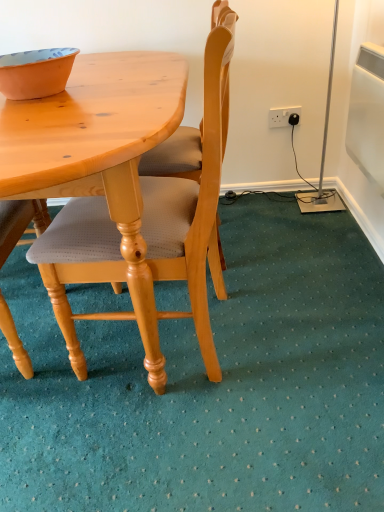
What do you see at coordinates (284, 116) in the screenshot?
I see `white plastic power outlet at upper right` at bounding box center [284, 116].

Locate an element on the screen. This screenshot has width=384, height=512. light wood/light brown chair at center is located at coordinates (192, 192).

Where is `bowl above the white plastic power outlet at upper right (from a real-world perspective)`? bowl above the white plastic power outlet at upper right (from a real-world perspective) is located at coordinates (35, 72).

Considering the points (284, 123) and (0, 62), which point is in front, point (284, 123) or point (0, 62)?

The point (0, 62) is closer to the camera.

Is white plastic power outlet at upper right wider than orange matte bowl at upper left?

In fact, white plastic power outlet at upper right might be narrower than orange matte bowl at upper left.

Is white plastic power outlet at upper right oriented towards orange matte bowl at upper left?

No, white plastic power outlet at upper right is not turned towards orange matte bowl at upper left.

From the image's perspective, would you say orange matte bowl at upper left is positioned over light wood/light brown chair at center?

Yes, from the image's perspective, orange matte bowl at upper left is above light wood/light brown chair at center.

Which is in front, point (76, 52) or point (109, 248)?

The point (109, 248) is closer.

Which object is positioned more to the right, orange matte bowl at upper left or light wood/light brown chair at center?

Positioned to the right is light wood/light brown chair at center.

You are a GUI agent. You are given a task and a screenshot of the screen. Output one action in this format:
    pyautogui.click(x=<x>, y=<y>)
    Task: Click on the power outlet behind the light wood/light brown chair at center
    
    Given the screenshot: What is the action you would take?
    coord(284,116)

Is light wood/light brown chair at center closer to the viewer compared to white plastic power outlet at upper right?

Yes, light wood/light brown chair at center is closer to the camera.

Is light wood/light brown chair at center facing away from white plastic power outlet at upper right?

light wood/light brown chair at center is not turned away from white plastic power outlet at upper right.

From the picture: Is there a large distance between light wood/light brown chair at center and white plastic power outlet at upper right?

Yes.

Is white plastic power outlet at upper right positioned in front of light wood/light brown chair at center?

No, it is not.

Is white plastic power outlet at upper right beside light wood/light brown chair at center?

There is a gap between white plastic power outlet at upper right and light wood/light brown chair at center.

From a real-world perspective, does white plastic power outlet at upper right stand above light wood/light brown chair at center?

No, from a real-world perspective, white plastic power outlet at upper right is not over light wood/light brown chair at center

Considering the relative positions of white plastic power outlet at upper right and light wood/light brown chair at center in the image provided, is white plastic power outlet at upper right to the right of light wood/light brown chair at center from the viewer's perspective?

Correct, you'll find white plastic power outlet at upper right to the right of light wood/light brown chair at center.

Which object is positioned more to the left, orange matte bowl at upper left or white plastic power outlet at upper right?

From the viewer's perspective, orange matte bowl at upper left appears more on the left side.

From the image's perspective, would you say orange matte bowl at upper left is shown under white plastic power outlet at upper right?

Yes, from the image's perspective, orange matte bowl at upper left is beneath white plastic power outlet at upper right.

Is orange matte bowl at upper left not close to white plastic power outlet at upper right?

Absolutely, orange matte bowl at upper left is distant from white plastic power outlet at upper right.

The image size is (384, 512). Identify the location of bowl that appears on the left of white plastic power outlet at upper right. (35, 72).

Is point (209, 263) positioned in front of point (25, 65)?

No.

Is light wood/light brown chair at center surrounding orange matte bowl at upper left?

Definitely not — orange matte bowl at upper left is not inside light wood/light brown chair at center.

Which object is more forward, light wood/light brown chair at center or orange matte bowl at upper left?

light wood/light brown chair at center is in front.

Which object is thinner, light wood/light brown chair at center or orange matte bowl at upper left?

orange matte bowl at upper left.

This screenshot has width=384, height=512. What are the coordinates of `bowl on the left of white plastic power outlet at upper right` in the screenshot? It's located at (35, 72).

The width and height of the screenshot is (384, 512). I want to click on bowl located above the light wood/light brown chair at center (from a real-world perspective), so click(x=35, y=72).

Looking at the image, which one is located further to light wood/light brown chair at center, white plastic power outlet at upper right or orange matte bowl at upper left?

Based on the image, white plastic power outlet at upper right appears to be further to light wood/light brown chair at center.

Looking at the image, which one is located further to white plastic power outlet at upper right, orange matte bowl at upper left or light wood/light brown chair at center?

Among the two, orange matte bowl at upper left is located further to white plastic power outlet at upper right.

Based on their spatial positions, is light wood/light brown chair at center or white plastic power outlet at upper right further from orange matte bowl at upper left?

Based on the image, white plastic power outlet at upper right appears to be further to orange matte bowl at upper left.

From the image, which object appears to be farther from light wood/light brown chair at center, orange matte bowl at upper left or white plastic power outlet at upper right?

Based on the image, white plastic power outlet at upper right appears to be further to light wood/light brown chair at center.

Considering their positions, is white plastic power outlet at upper right positioned further to orange matte bowl at upper left than light wood/light brown chair at center?

The object further to orange matte bowl at upper left is white plastic power outlet at upper right.

Considering their positions, is light wood/light brown chair at center positioned further to white plastic power outlet at upper right than orange matte bowl at upper left?

orange matte bowl at upper left lies further to white plastic power outlet at upper right than the other object.

Where is `bowl positioned between light wood/light brown chair at center and white plastic power outlet at upper right from near to far`? The width and height of the screenshot is (384, 512). bowl positioned between light wood/light brown chair at center and white plastic power outlet at upper right from near to far is located at coordinates (35, 72).